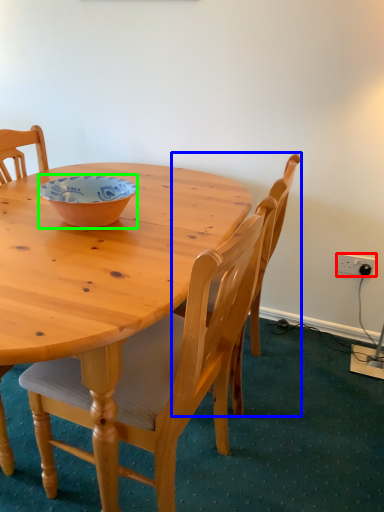
Question: Which object is the farthest from power outlet (highlighted by a red box)? Choose among these: chair (highlighted by a blue box) or bowl (highlighted by a green box).

Choices:
 (A) chair
 (B) bowl

Answer: (B)